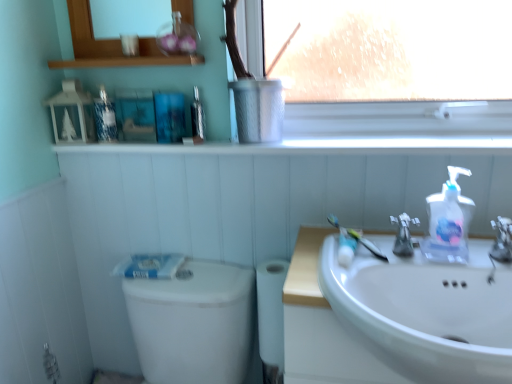
You are a GUI agent. You are given a task and a screenshot of the screen. Output one action in this format:
    pyautogui.click(x=<x>, y=<y>)
    Task: Click on the free space above metallic silver window sill at upper center, the second window sill in the bottom-to-top sequence (from a real-world perspective)
    
    Given the screenshot: What is the action you would take?
    pyautogui.click(x=127, y=53)